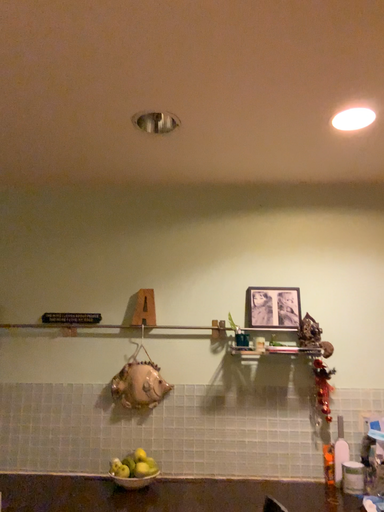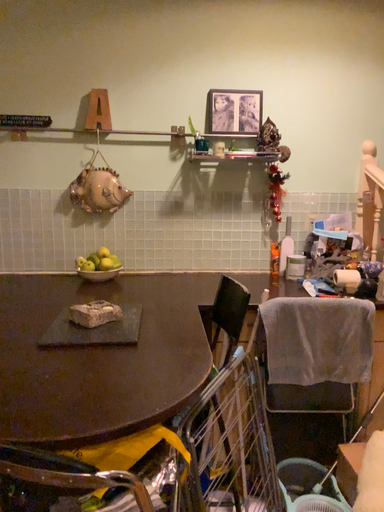
Question: Which way did the camera rotate in the video?

Choices:
 (A) rotated upward
 (B) rotated downward

Answer: (B)